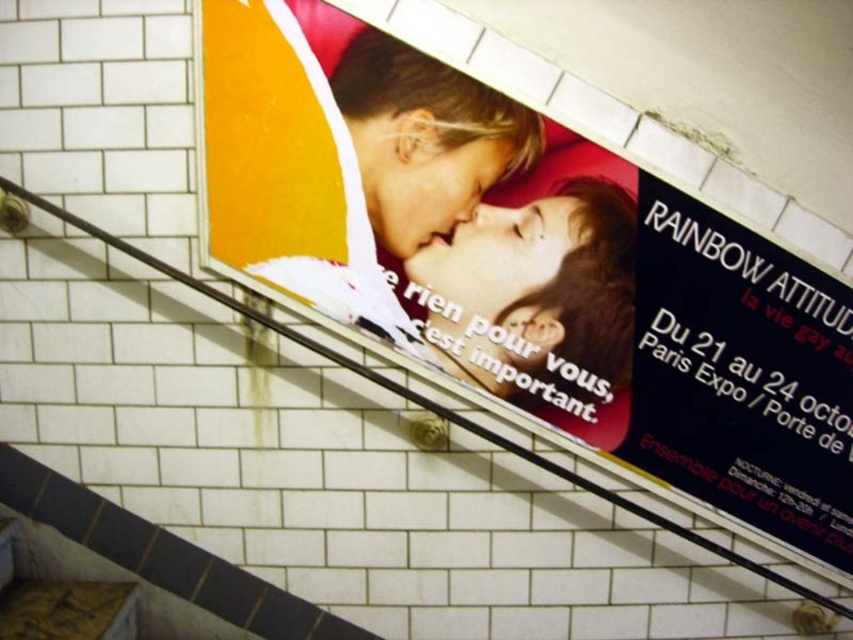
You are a subway passenger who wants to read both the matte plastic poster at center and the black glossy poster at upper right. Which poster should you stand closer to in order to read them comfortably?

The matte plastic poster at center might be wider than black glossy poster at upper right, so you should stand closer to the matte plastic poster at center to read it comfortably and farther from the black glossy poster at upper right.

You are an art student analyzing the subway station wall. You notice two posters, the matte plastic poster at center and the black glossy poster at upper right. Which poster is taller?

The matte plastic poster at center is taller than the black glossy poster at upper right.